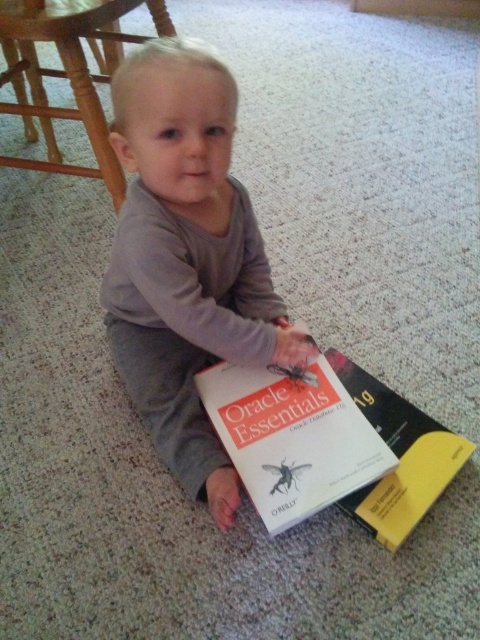
Is hardcover book at center below matte black spider at center?

Yes.

Is point (371, 525) farther from viewer compared to point (272, 364)?

No, it is not.

Is point (409, 477) farther from camera compared to point (278, 368)?

No, (409, 477) is closer to viewer.

The width and height of the screenshot is (480, 640). I want to click on hardcover book at center, so click(398, 456).

Who is taller, gray matte/soft baby at center or white paper book at center?

With more height is gray matte/soft baby at center.

The image size is (480, 640). Find the location of `gray matte/soft baby at center`. gray matte/soft baby at center is located at coordinates (187, 259).

Does white paper book at center appear on the right side of matte black spider at center?

Incorrect, white paper book at center is not on the right side of matte black spider at center.

Can you confirm if white paper book at center is taller than matte black spider at center?

Yes, white paper book at center is taller than matte black spider at center.

Is point (280, 396) farther from camera compared to point (274, 371)?

No, it is in front of (274, 371).

At what (x,y) coordinates should I click in order to perform the action: click on white paper book at center. Please return your answer as a coordinate pair (x, y). The height and width of the screenshot is (640, 480). Looking at the image, I should click on (292, 436).